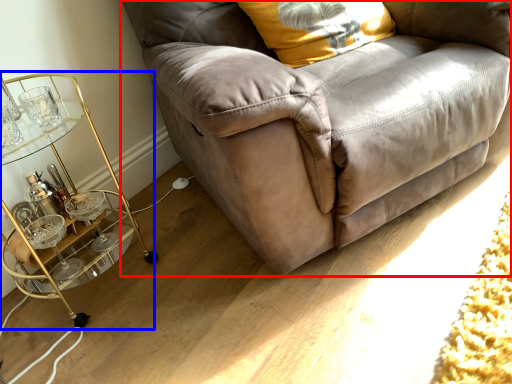
Question: Which of the following is the closest to the observer, studio couch (highlighted by a red box) or table (highlighted by a blue box)?

Choices:
 (A) studio couch
 (B) table

Answer: (A)